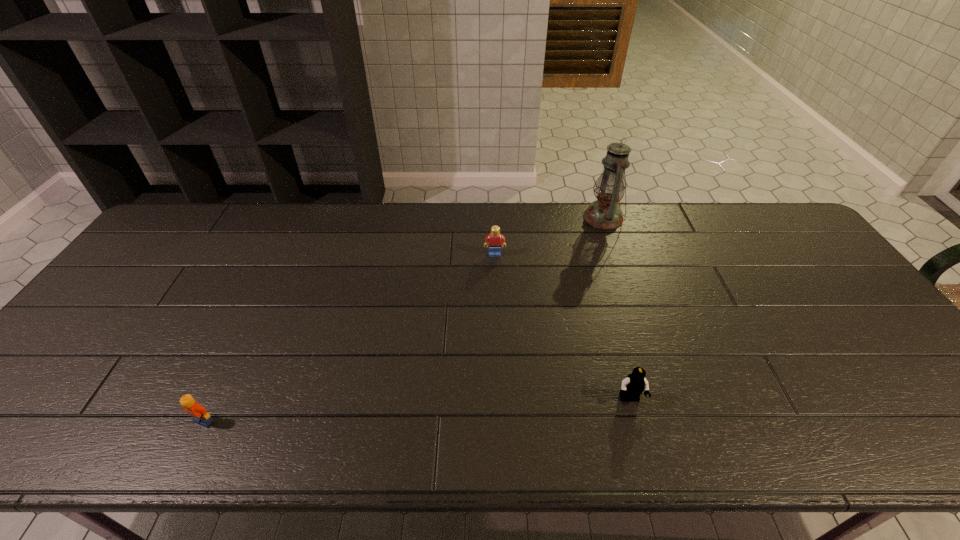
This screenshot has height=540, width=960. What are the coordinates of `vacant space located 0.060m on the front-facing side of the second nearest object` in the screenshot? It's located at (638, 433).

Locate an element on the screen. object situated at the far edge is located at coordinates (604, 213).

Find the location of a particular element. The height and width of the screenshot is (540, 960). object present at the near edge is located at coordinates click(194, 409).

In the image, there is a desktop. Identify the location of vacant space at the far edge. (516, 211).

The height and width of the screenshot is (540, 960). In the image, there is a desktop. Find the location of `vacant space at the near edge`. vacant space at the near edge is located at coordinates (848, 431).

Locate an element on the screen. The width and height of the screenshot is (960, 540). vacant space at the left edge of the desktop is located at coordinates (140, 308).

Locate an element on the screen. This screenshot has width=960, height=540. vacant region at the right edge is located at coordinates (868, 320).

The image size is (960, 540). What are the coordinates of `vacant area at the far right corner of the desktop` in the screenshot? It's located at (754, 230).

You are a GUI agent. You are given a task and a screenshot of the screen. Output one action in this format:
    pyautogui.click(x=<x>, y=<y>)
    Task: Click on the vacant space in between the rightmost Lego and the leftmost object
    Image resolution: width=960 pixels, height=540 pixels.
    Given the screenshot: What is the action you would take?
    pyautogui.click(x=417, y=410)

Where is `empty space that is in between the leftmost object and the second farthest Lego`? empty space that is in between the leftmost object and the second farthest Lego is located at coordinates (417, 410).